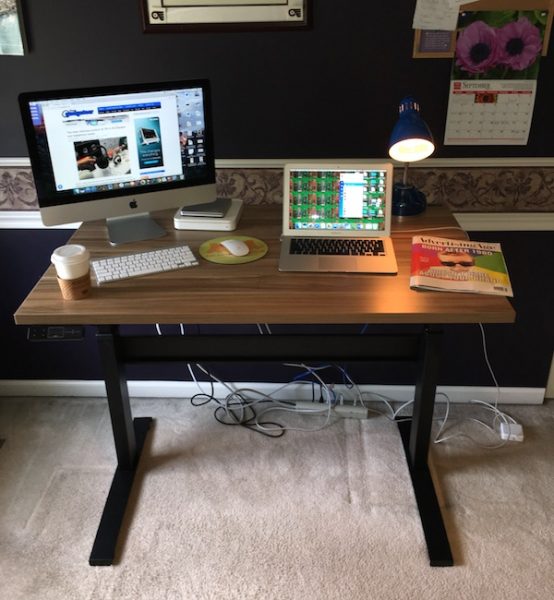
Find the location of a particular element. The image size is (554, 600). laptop is located at coordinates (324, 177).